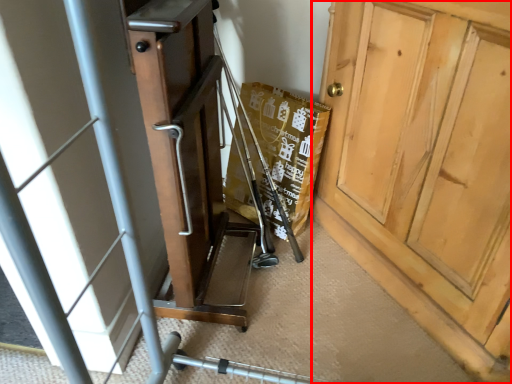
Question: In this image, where is door (annotated by the red box) located relative to baby carriage?

Choices:
 (A) right
 (B) left

Answer: (A)